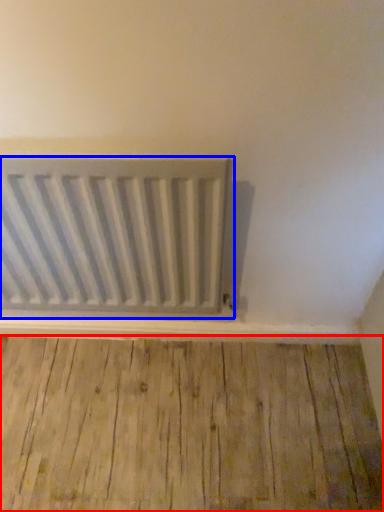
Question: Which object appears farthest to the camera in this image, hardwood (highlighted by a red box) or radiator (highlighted by a blue box)?

Choices:
 (A) hardwood
 (B) radiator

Answer: (A)